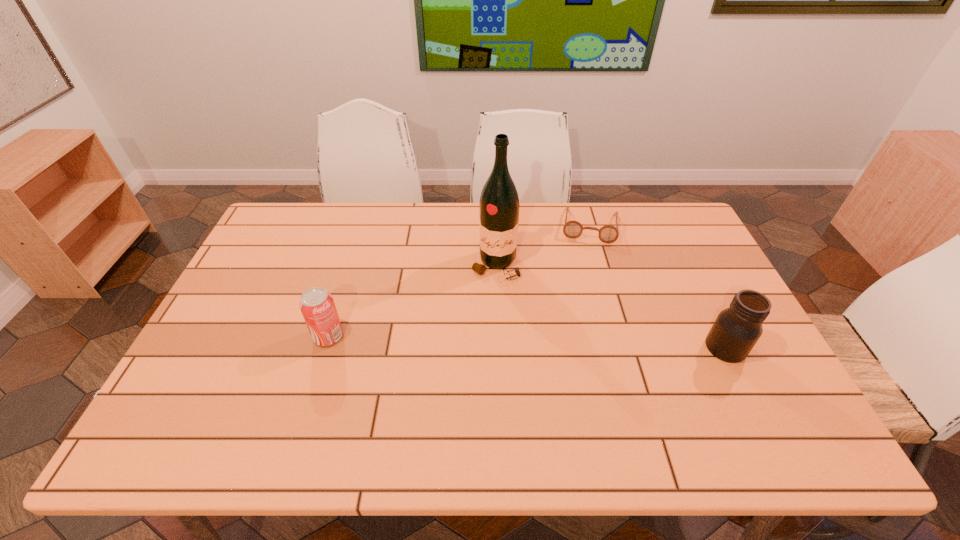
The image size is (960, 540). In order to click on soda can in this screenshot , I will do `click(317, 306)`.

Where is `the third tallest object`? The height and width of the screenshot is (540, 960). the third tallest object is located at coordinates (317, 306).

Image resolution: width=960 pixels, height=540 pixels. What are the coordinates of `the rightmost object` in the screenshot? It's located at (736, 330).

The image size is (960, 540). In order to click on the tallest object in this screenshot , I will do `click(499, 203)`.

Find the location of a particular element. The width and height of the screenshot is (960, 540). wine bottle is located at coordinates (499, 203).

Image resolution: width=960 pixels, height=540 pixels. I want to click on the farthest object, so click(572, 229).

The width and height of the screenshot is (960, 540). In order to click on spectacles in this screenshot , I will do `click(572, 229)`.

Where is `vacant space situated 0.130m on the logo side of the soda can`? vacant space situated 0.130m on the logo side of the soda can is located at coordinates (265, 336).

The height and width of the screenshot is (540, 960). In order to click on vacant space positioned 0.290m on the logo side of the soda can in this screenshot , I will do `click(206, 336)`.

This screenshot has height=540, width=960. In order to click on blank space located 0.220m on the logo side of the soda can in this screenshot , I will do `click(232, 336)`.